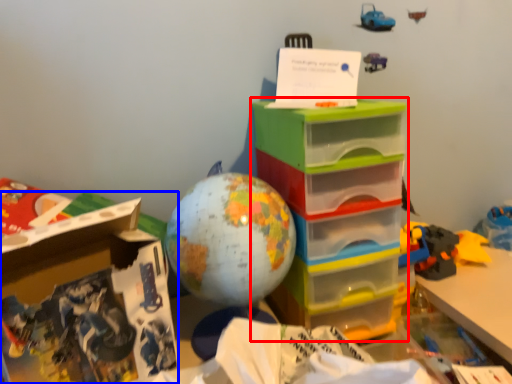
Question: Which of the following is the farthest to the observer, storage box (highlighted by a red box) or cardboard box (highlighted by a blue box)?

Choices:
 (A) storage box
 (B) cardboard box

Answer: (A)